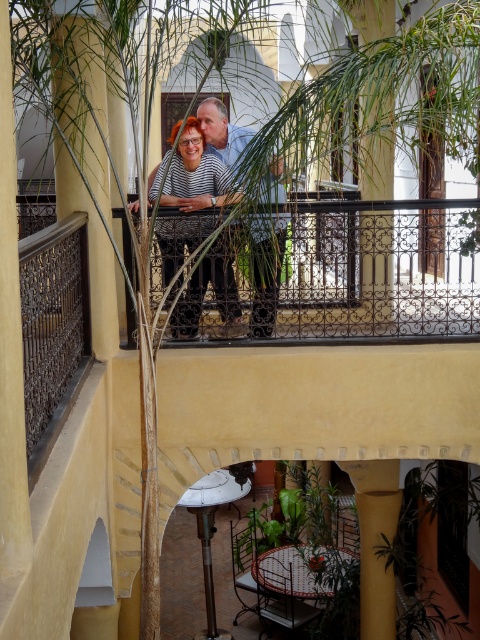
Question: Considering the real-world distances, which object is closest to the light blue shirt at center?

Choices:
 (A) smooth yellow pillar at center
 (B) striped fabric shirt at center

Answer: (B)

Question: Does striped fabric shirt at center have a larger size compared to light blue shirt at center?

Choices:
 (A) yes
 (B) no

Answer: (A)

Question: Which of these objects is positioned farthest from the striped fabric shirt at center?

Choices:
 (A) light blue shirt at center
 (B) smooth yellow pillar at center

Answer: (B)

Question: Does smooth yellow pillar at center have a lesser width compared to light blue shirt at center?

Choices:
 (A) yes
 (B) no

Answer: (B)

Question: Is striped fabric shirt at center smaller than light blue shirt at center?

Choices:
 (A) no
 (B) yes

Answer: (A)

Question: Which point is closer to the camera?

Choices:
 (A) striped fabric shirt at center
 (B) light blue shirt at center

Answer: (B)